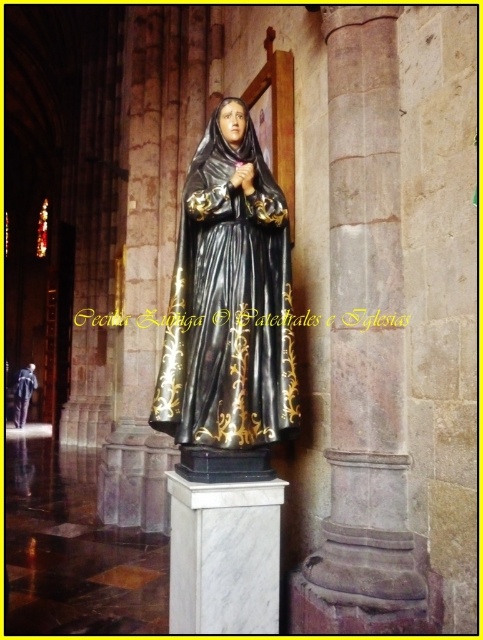
You are standing in front of the statue and want to locate two specific points on the pedestal. The first point is at coordinates point (x=269, y=332) and the second is at point (x=22, y=422). Which point is closer to you?

Point (x=269, y=332) is in front of point (x=22, y=422), so it is closer to you.

You are standing in front of the statue and want to touch the two points on the statue. Which point is closer to you, point (204, 497) or point (16, 403)?

Point (204, 497) is closer to the viewer than point (16, 403).